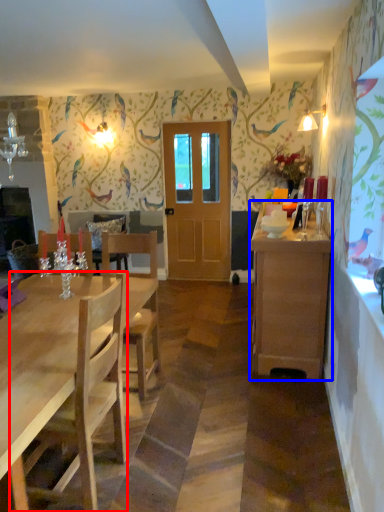
Question: Which object is closer to the camera taking this photo, chair (highlighted by a red box) or cabinetry (highlighted by a blue box)?

Choices:
 (A) chair
 (B) cabinetry

Answer: (A)